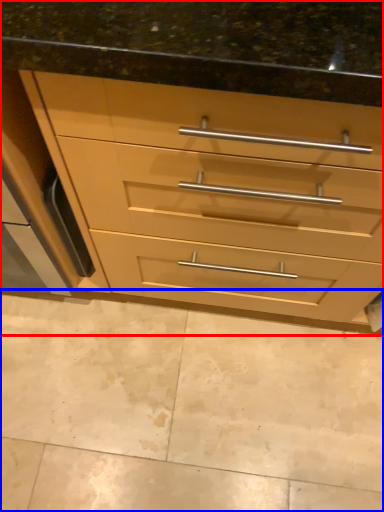
Question: Among these objects, which one is nearest to the camera, chest of drawers (highlighted by a red box) or granite (highlighted by a blue box)?

Choices:
 (A) chest of drawers
 (B) granite

Answer: (A)